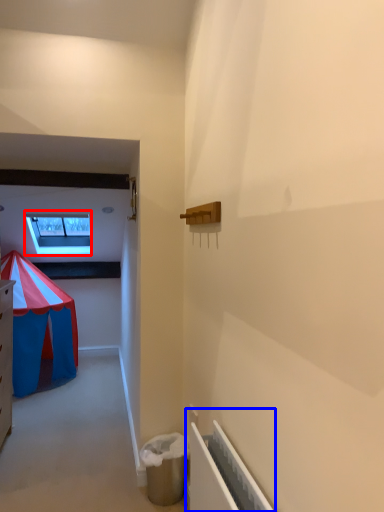
Question: Which object is further to the camera taking this photo, window (highlighted by a red box) or radiator (highlighted by a blue box)?

Choices:
 (A) window
 (B) radiator

Answer: (A)